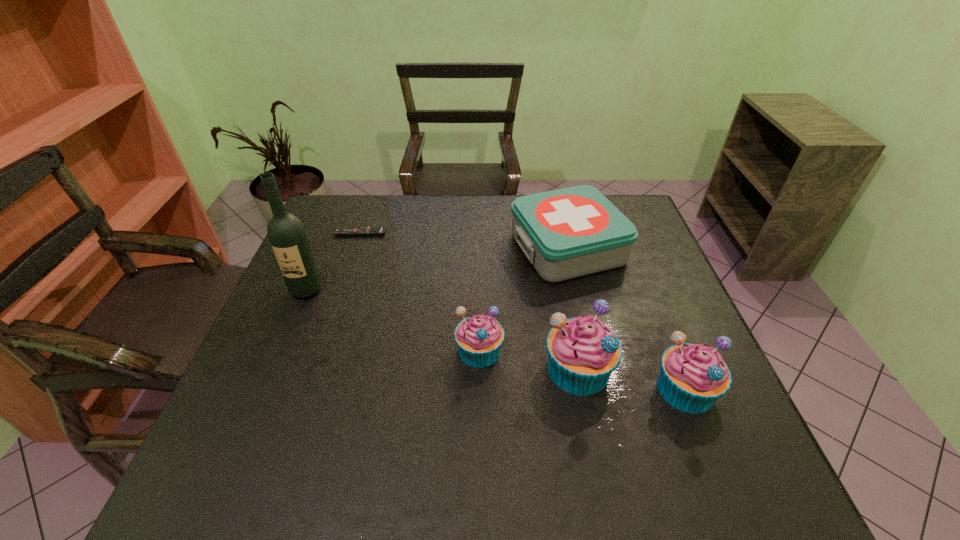
At what (x,y) coordinates should I click in order to perform the action: click on the first-aid kit at the right edge. Please return your answer as a coordinate pair (x, y). Looking at the image, I should click on (576, 231).

The image size is (960, 540). I want to click on object at the far left corner, so click(x=378, y=230).

The image size is (960, 540). Identify the location of object present at the far right corner. (576, 231).

Identify the location of object at the near right corner. Image resolution: width=960 pixels, height=540 pixels. (693, 376).

Where is `blank area at the far edge`? blank area at the far edge is located at coordinates pos(387,199).

Locate an element on the screen. vacant space at the near edge of the desktop is located at coordinates (649, 426).

Identify the location of free space at the left edge. This screenshot has height=540, width=960. (293, 304).

The height and width of the screenshot is (540, 960). Identify the location of free space at the right edge of the desktop. (660, 368).

This screenshot has height=540, width=960. In the image, there is a desktop. Identify the location of free region at the far left corner. (334, 223).

Identify the location of vacant space at the near left corner. Image resolution: width=960 pixels, height=540 pixels. (218, 435).